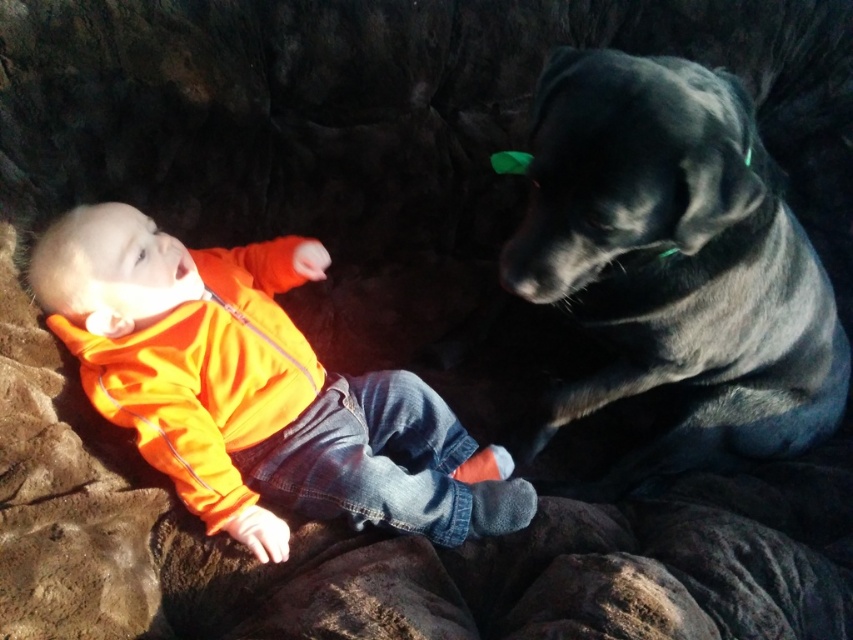
Question: Which point is closer to the camera?

Choices:
 (A) shiny black fur at upper right
 (B) orange fleece jacket at upper left

Answer: (A)

Question: Where is shiny black fur at upper right located in relation to orange fleece jacket at upper left in the image?

Choices:
 (A) above
 (B) below

Answer: (A)

Question: Is shiny black fur at upper right bigger than orange fleece jacket at upper left?

Choices:
 (A) no
 (B) yes

Answer: (B)

Question: Does shiny black fur at upper right appear under orange fleece jacket at upper left?

Choices:
 (A) yes
 (B) no

Answer: (B)